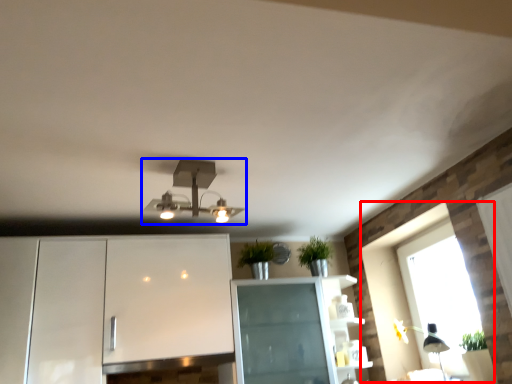
Question: Which of the following is the farthest to the observer, window (highlighted by a red box) or lamp (highlighted by a blue box)?

Choices:
 (A) window
 (B) lamp

Answer: (A)